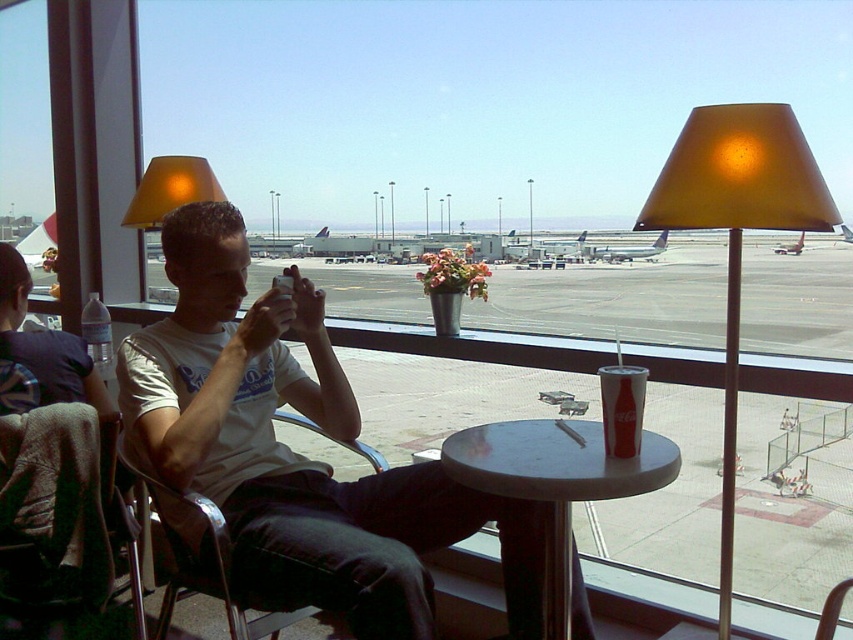
Question: Does concrete tarmac at center have a lesser width compared to metallic silver chair at left?

Choices:
 (A) yes
 (B) no

Answer: (B)

Question: Which point is closer to the camera?

Choices:
 (A) (90, 424)
 (B) (636, 248)
 (C) (225, 541)
 (D) (148, 221)

Answer: (C)

Question: Which point is farther from the camera taking this photo?

Choices:
 (A) (651, 250)
 (B) (61, 435)

Answer: (A)

Question: Does metallic silver chair at left have a smaller size compared to matte yellow lampshade at upper left?

Choices:
 (A) no
 (B) yes

Answer: (B)

Question: Which object is positioned farthest from the matte yellow lampshade at upper left?

Choices:
 (A) white cotton shirt at center
 (B) metallic silver chair at left
 (C) metallic silver airplane at center
 (D) matte gold lampshade at right

Answer: (C)

Question: Can you confirm if concrete tarmac at center is positioned above matte gold lampshade at right?

Choices:
 (A) yes
 (B) no

Answer: (A)